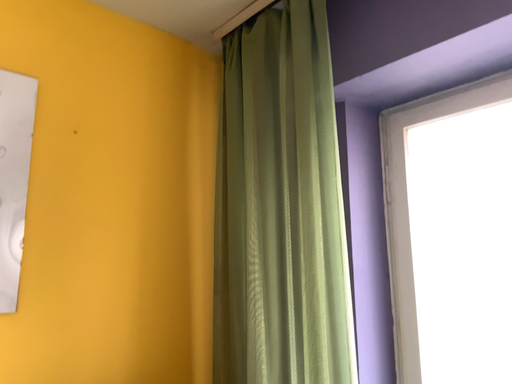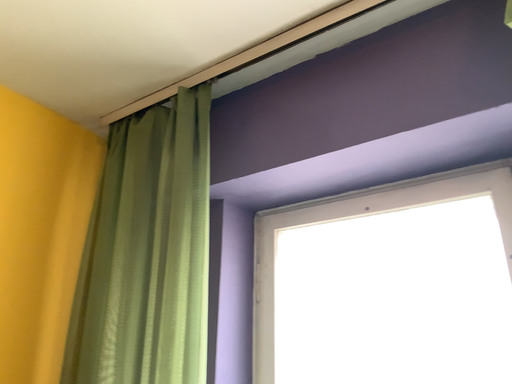
Question: Which way did the camera rotate in the video?

Choices:
 (A) rotated upward
 (B) rotated downward

Answer: (A)